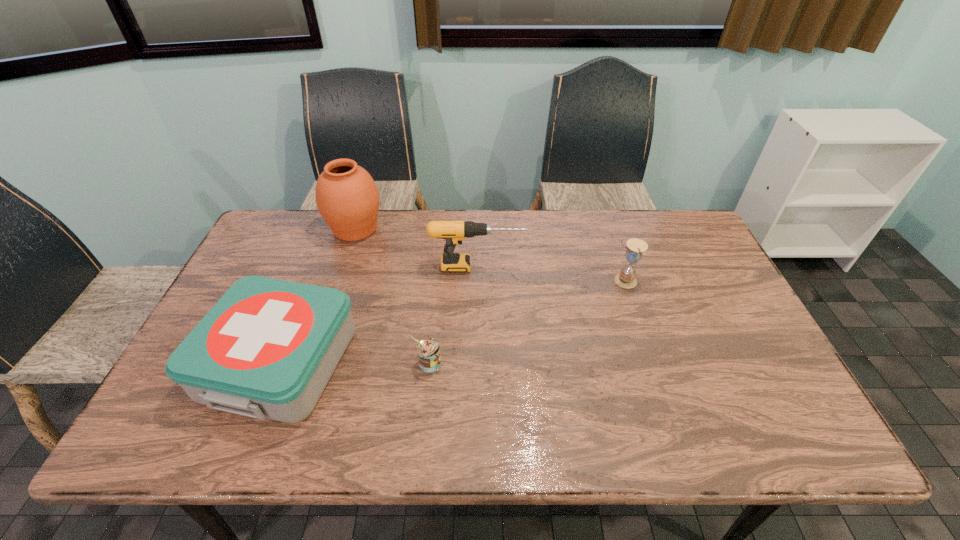
I want to click on the farthest object, so click(x=347, y=197).

You are a GUI agent. You are given a task and a screenshot of the screen. Output one action in this format:
    pyautogui.click(x=<x>, y=<y>)
    Task: Click on the urn
    
    Given the screenshot: What is the action you would take?
    [x=347, y=197]

Find the location of `drill`. drill is located at coordinates (454, 232).

You are a GUI agent. You are given a task and a screenshot of the screen. Output one action in this format:
    pyautogui.click(x=<x>, y=<y>)
    Task: Click on the hourglass
    The height and width of the screenshot is (540, 960).
    Given the screenshot: What is the action you would take?
    pyautogui.click(x=635, y=247)

This screenshot has height=540, width=960. I want to click on the first-aid kit, so click(x=267, y=349).

Locate an element on the screen. Image resolution: width=960 pixels, height=540 pixels. the shortest object is located at coordinates (428, 350).

Identify the location of free space located 0.260m on the front of the tallest object. (329, 307).

This screenshot has height=540, width=960. Find the location of `blank space located on the handle side of the drill`. blank space located on the handle side of the drill is located at coordinates (651, 266).

I want to click on free point located on the back of the rightmost object, so click(602, 216).

Where is `vacant area situated 0.300m on the back of the first-aid kit`? vacant area situated 0.300m on the back of the first-aid kit is located at coordinates (327, 240).